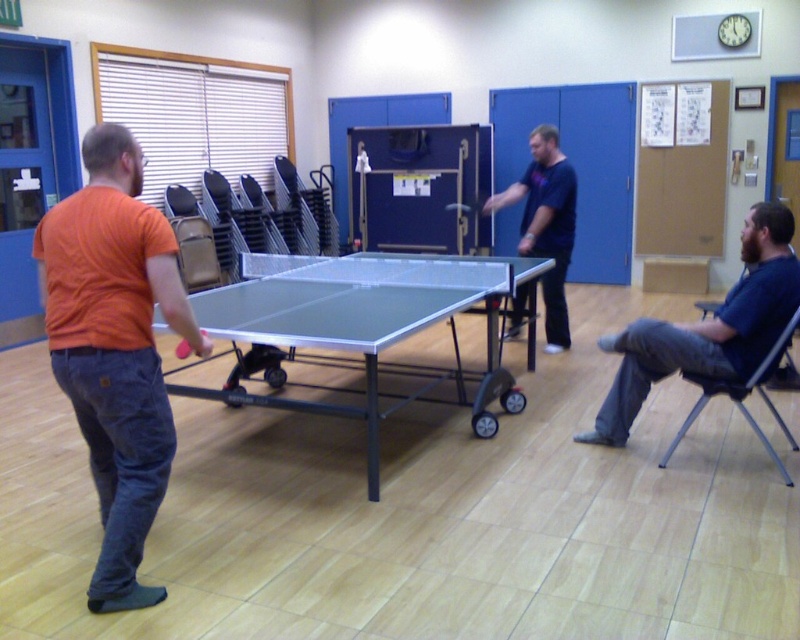
Does blue cotton shirt at right have a larger size compared to dark blue shirt at center?

Incorrect, blue cotton shirt at right is not larger than dark blue shirt at center.

Who is shorter, blue cotton shirt at right or dark blue shirt at center?

With less height is blue cotton shirt at right.

Between point (784, 292) and point (554, 273), which one is positioned in front?

Point (784, 292)

Image resolution: width=800 pixels, height=640 pixels. In order to click on blue cotton shirt at right in this screenshot , I will do `click(708, 326)`.

Does orange cotton t-shirt at left appear over metallic gray chair at lower right?

Indeed, orange cotton t-shirt at left is positioned over metallic gray chair at lower right.

Between orange cotton t-shirt at left and metallic gray chair at lower right, which one has more height?

orange cotton t-shirt at left is taller.

You are a GUI agent. You are given a task and a screenshot of the screen. Output one action in this format:
    pyautogui.click(x=<x>, y=<y>)
    Task: Click on the orange cotton t-shirt at left
    This screenshot has width=800, height=640.
    Given the screenshot: What is the action you would take?
    pyautogui.click(x=114, y=348)

Which is behind, point (192, 349) or point (568, 216)?

Point (568, 216)

Measure the distance between orange cotton t-shirt at left and camera.

They are 2.28 meters apart.

The height and width of the screenshot is (640, 800). What do you see at coordinates (114, 348) in the screenshot?
I see `orange cotton t-shirt at left` at bounding box center [114, 348].

Find the location of a particular element. orange cotton t-shirt at left is located at coordinates (114, 348).